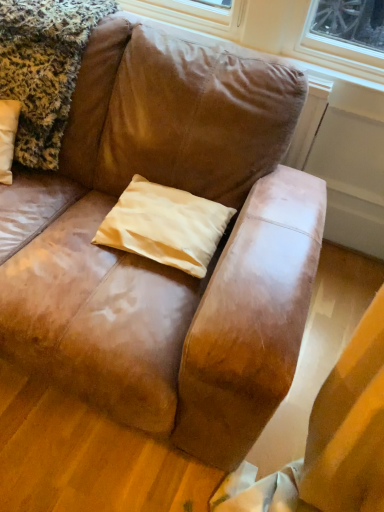
Question: Based on their sizes in the image, would you say beige satin pillow at center is bigger or smaller than fluffy leopard print blanket at upper left?

Choices:
 (A) big
 (B) small

Answer: (B)

Question: Relative to fluffy leopard print blanket at upper left, is beige satin pillow at center in front or behind?

Choices:
 (A) front
 (B) behind

Answer: (B)

Question: Is beige satin pillow at center wider or thinner than fluffy leopard print blanket at upper left?

Choices:
 (A) wide
 (B) thin

Answer: (B)

Question: From the image's perspective, relative to beige satin pillow at center, is fluffy leopard print blanket at upper left above or below?

Choices:
 (A) above
 (B) below

Answer: (A)

Question: Would you say fluffy leopard print blanket at upper left is to the left or to the right of beige satin pillow at center in the picture?

Choices:
 (A) right
 (B) left

Answer: (B)

Question: Considering the positions of point click(29, 57) and point click(190, 252), is point click(29, 57) closer or farther from the camera than point click(190, 252)?

Choices:
 (A) farther
 (B) closer

Answer: (A)

Question: Considering the positions of fluffy leopard print blanket at upper left and beige satin pillow at center in the image, is fluffy leopard print blanket at upper left wider or thinner than beige satin pillow at center?

Choices:
 (A) wide
 (B) thin

Answer: (A)